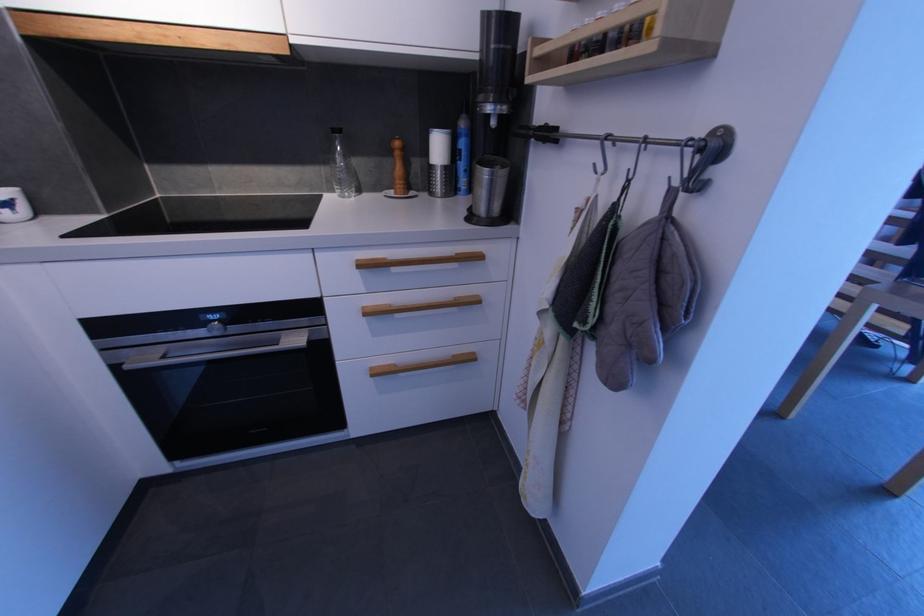
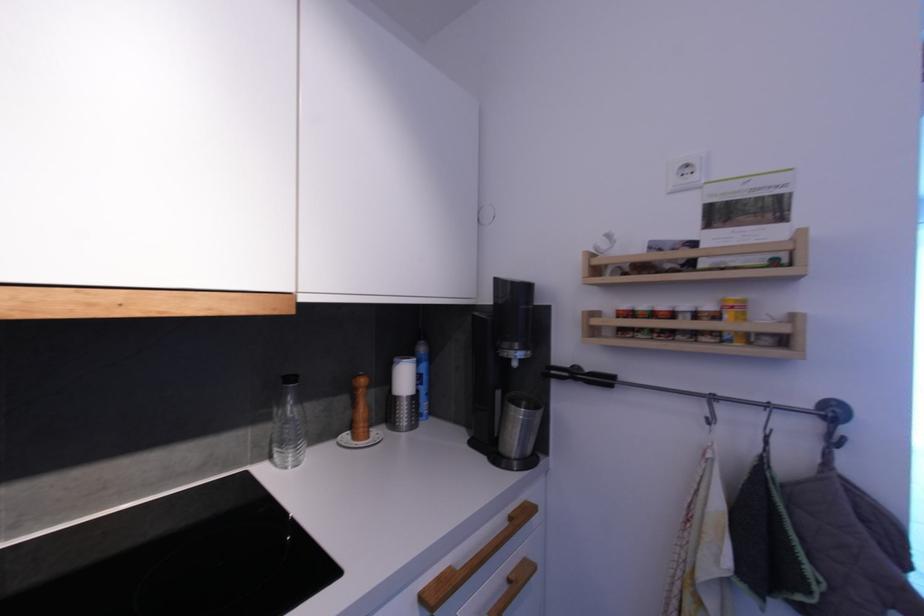
First-person continuous shooting, in which direction is the camera rotating?

The camera rotated toward right-up.